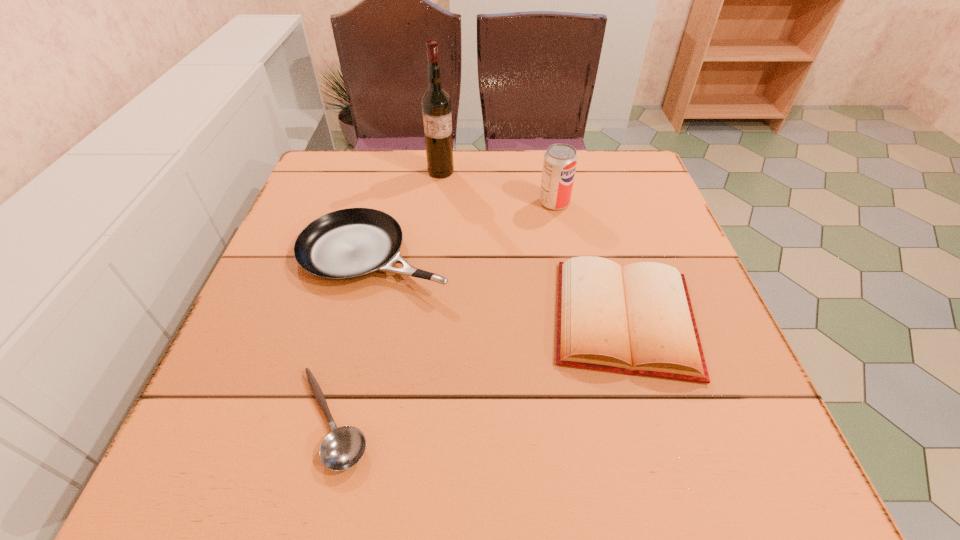
Where is `unoccupied position between the shortest object and the farthest object`? unoccupied position between the shortest object and the farthest object is located at coordinates (387, 295).

At what (x,y) coordinates should I click in order to perform the action: click on unoccupied position between the soda and the tallest object. Please return your answer as a coordinate pair (x, y). Looking at the image, I should click on (497, 187).

This screenshot has height=540, width=960. Identify the location of vacant space that's between the wine bottle and the shortest object. (387, 295).

The image size is (960, 540). What are the coordinates of `free spot between the second shortest object and the wine bottle` in the screenshot? It's located at (533, 245).

Find the location of `free spot between the second tallest object and the ladle`. free spot between the second tallest object and the ladle is located at coordinates (444, 310).

This screenshot has height=540, width=960. In order to click on vacant space that is in between the shortest object and the soda in this screenshot , I will do `click(444, 310)`.

Identify which object is the third closest to the ladle. Please provide its 2D coordinates. Your answer should be formatted as a tuple, i.e. [(x, y)], where the tuple contains the x and y coordinates of a point satisfying the conditions above.

[(560, 160)]

Where is `object that can be found as the fourth closest to the farthest object`? This screenshot has height=540, width=960. object that can be found as the fourth closest to the farthest object is located at coordinates (343, 447).

Locate an element on the screen. The height and width of the screenshot is (540, 960). vacant area in the image that satisfies the following two spatial constraints: 1. on the back side of the shortest object; 2. on the left side of the second farthest object is located at coordinates (386, 202).

You are a GUI agent. You are given a task and a screenshot of the screen. Output one action in this format:
    pyautogui.click(x=<x>, y=<y>)
    Task: Click on the vacant region that satisfies the following two spatial constraints: 1. on the front and back of the tallest object; 2. on the left side of the second shortest object
    This screenshot has width=960, height=540.
    Given the screenshot: What is the action you would take?
    pyautogui.click(x=424, y=318)